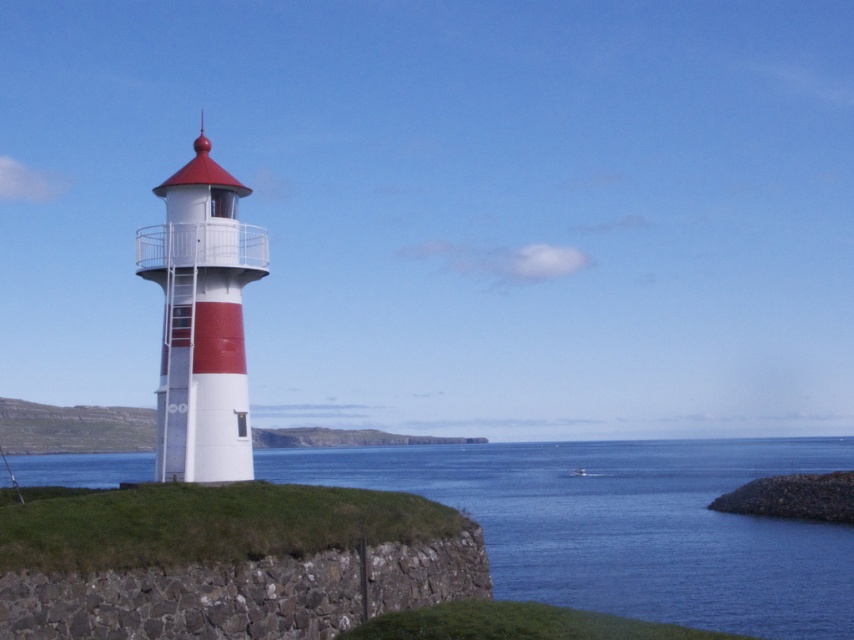
In the scene shown: Is blue water at lower left above smooth white lighthouse at left?

No, blue water at lower left is not above smooth white lighthouse at left.

Measure the distance between blue water at lower left and smooth white lighthouse at left.

blue water at lower left is 486.31 feet away from smooth white lighthouse at left.

Which is behind, point (559, 474) or point (182, 472)?

The point (559, 474) is more distant.

The height and width of the screenshot is (640, 854). What are the coordinates of `blue water at lower left` in the screenshot? It's located at (627, 524).

Does dark gray stone cliff at lower left appear on the left side of smooth white lighthouse at left?

No, dark gray stone cliff at lower left is not to the left of smooth white lighthouse at left.

Can you confirm if dark gray stone cliff at lower left is wider than smooth white lighthouse at left?

Indeed, dark gray stone cliff at lower left has a greater width compared to smooth white lighthouse at left.

This screenshot has width=854, height=640. What do you see at coordinates (225, 561) in the screenshot? I see `dark gray stone cliff at lower left` at bounding box center [225, 561].

Where is `dark gray stone cliff at lower left`? The width and height of the screenshot is (854, 640). dark gray stone cliff at lower left is located at coordinates (225, 561).

Which is more to the right, blue water at lower left or dark gray stone cliff at lower left?

From the viewer's perspective, dark gray stone cliff at lower left appears more on the right side.

Between point (533, 528) and point (320, 572), which one is positioned in front?

Point (320, 572) is more forward.

This screenshot has width=854, height=640. What do you see at coordinates (627, 524) in the screenshot?
I see `blue water at lower left` at bounding box center [627, 524].

Where is `blue water at lower left`? blue water at lower left is located at coordinates (627, 524).